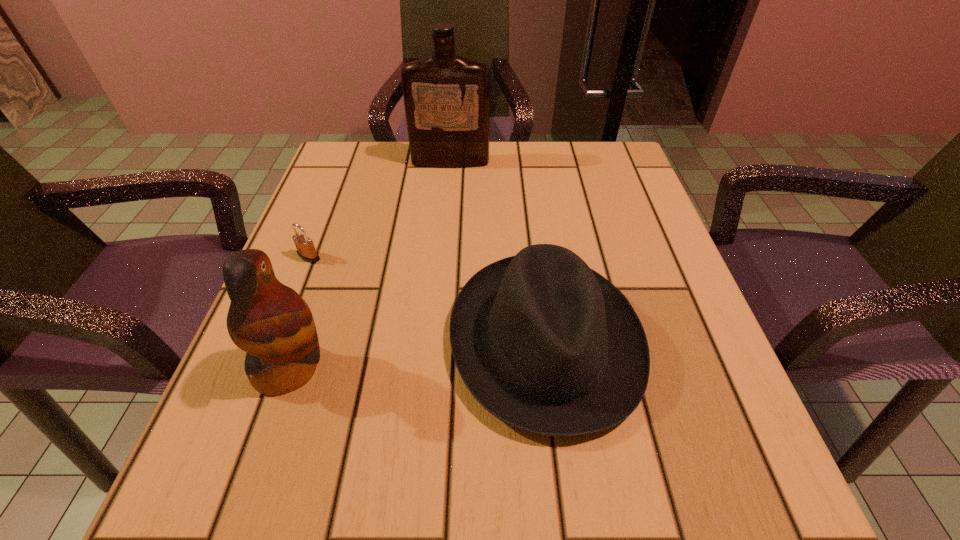
Locate an element on the screen. The height and width of the screenshot is (540, 960). object that is at the far edge is located at coordinates (446, 97).

The image size is (960, 540). What are the coordinates of `parrot at the left edge` in the screenshot? It's located at (270, 321).

This screenshot has height=540, width=960. Find the location of `padlock located at the left edge`. padlock located at the left edge is located at coordinates (306, 250).

At what (x,y) coordinates should I click in order to perform the action: click on object present at the right edge. Please return your answer as a coordinate pair (x, y). Looking at the image, I should click on (544, 343).

Find the location of a particular element. vacant space at the far edge is located at coordinates (425, 196).

Identify the location of vacant area at the near edge of the desktop. (334, 462).

What are the coordinates of `free space at the left edge of the desktop` in the screenshot? It's located at (325, 259).

Locate an element on the screen. vacant area at the right edge is located at coordinates (660, 278).

Locate an element on the screen. The height and width of the screenshot is (540, 960). free space at the far left corner of the desktop is located at coordinates (398, 141).

In the image, there is a desktop. At what (x,y) coordinates should I click in order to perform the action: click on vacant space at the near left corner. Please return your answer as a coordinate pair (x, y). Looking at the image, I should click on (210, 475).